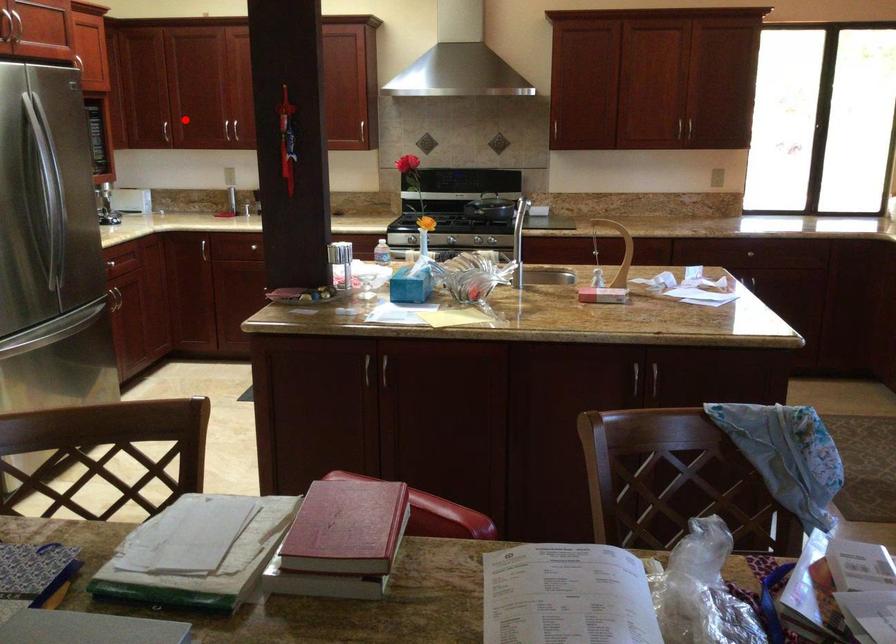
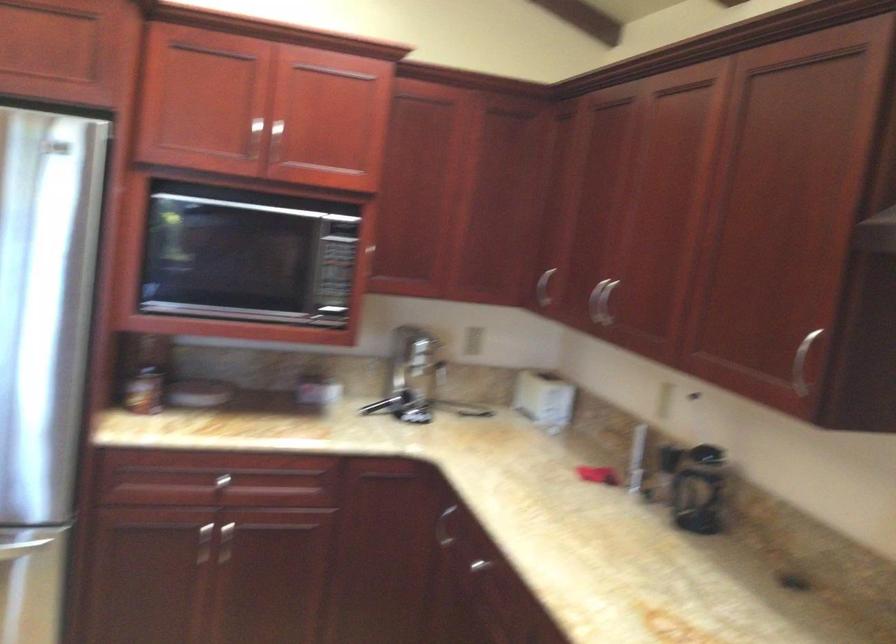
Where in the second image is the point corresponding to the highlighted location from the first image?

(600, 301)